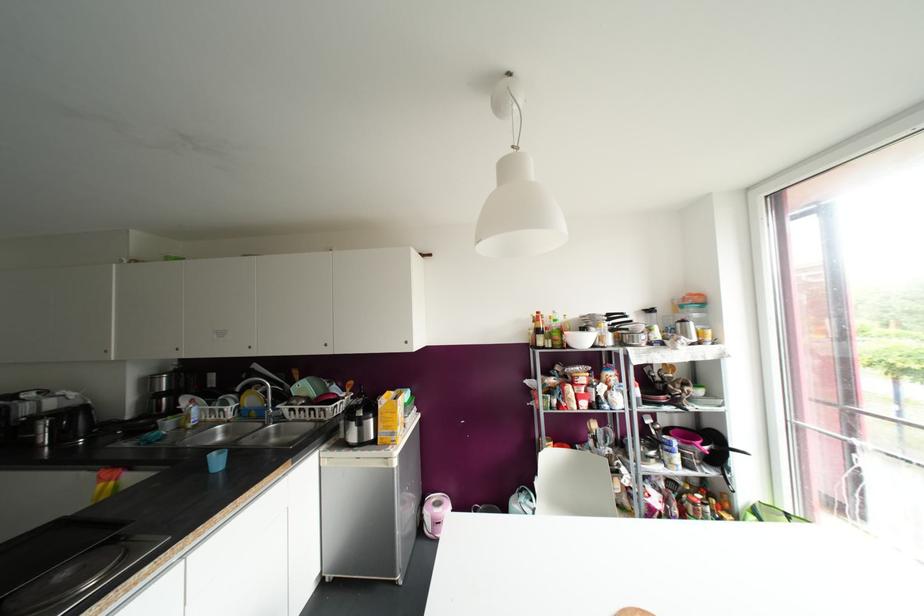
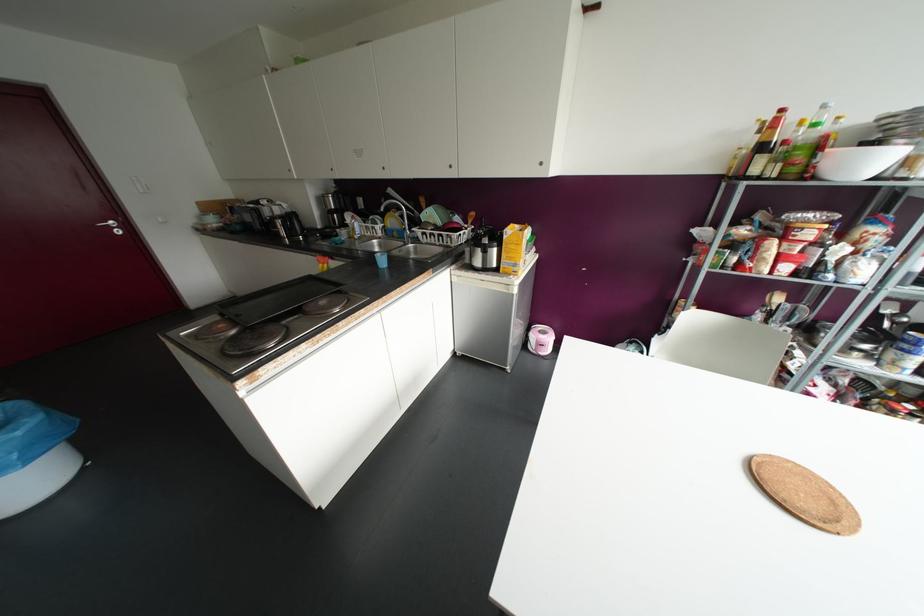
Find the pixel in the second image that matches point 537,312 in the first image.

(781, 110)